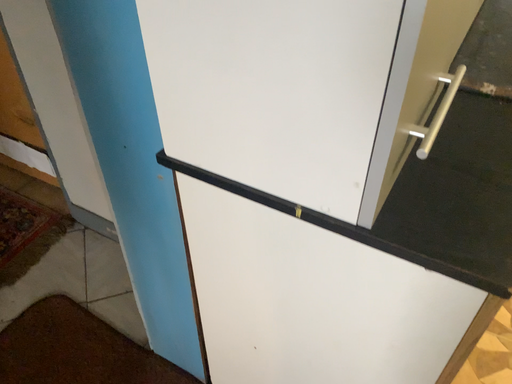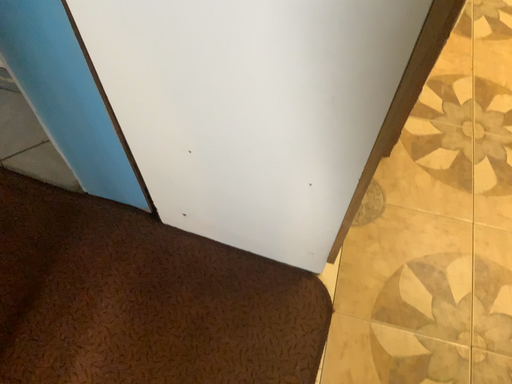
Question: How did the camera likely rotate when shooting the video?

Choices:
 (A) rotated right
 (B) rotated left

Answer: (A)